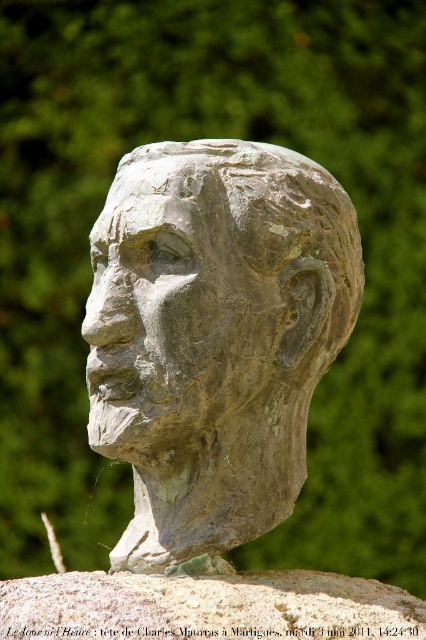
Question: Among these points, which one is farthest from the camera?

Choices:
 (A) (155, 454)
 (B) (147, 580)

Answer: (A)

Question: Among these objects, which one is farthest from the camera?

Choices:
 (A) gray stone bust at center
 (B) gray stone head at center

Answer: (B)

Question: Is gray stone head at center closer to camera compared to gray stone bust at center?

Choices:
 (A) no
 (B) yes

Answer: (A)

Question: Which of the following is the closest to the observer?

Choices:
 (A) gray stone bust at center
 (B) gray stone head at center

Answer: (A)

Question: Is gray stone head at center closer to camera compared to gray stone bust at center?

Choices:
 (A) yes
 (B) no

Answer: (B)

Question: From the image, what is the correct spatial relationship of gray stone head at center in relation to gray stone bust at center?

Choices:
 (A) above
 (B) below

Answer: (A)